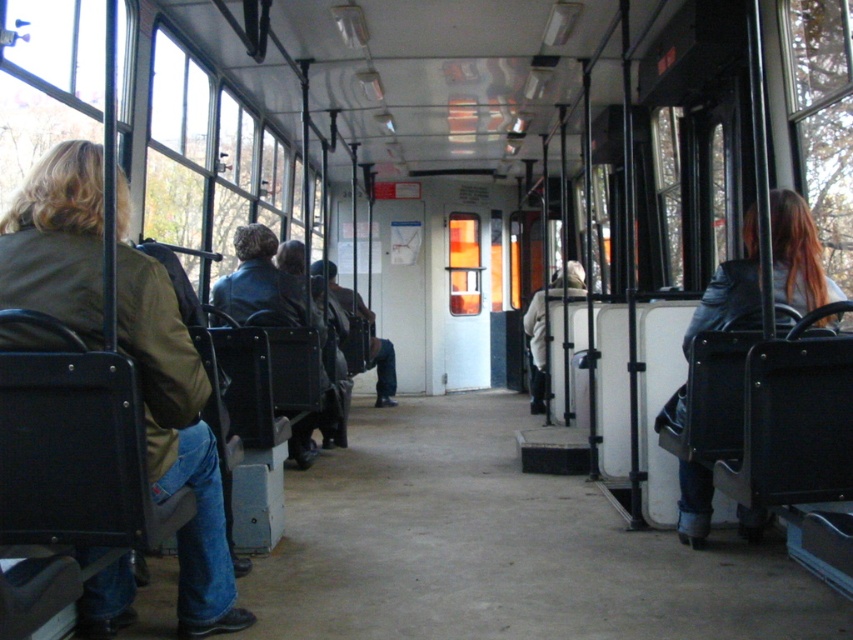
You are standing at the front of the public transportation vehicle and want to reach a destination point located at point (x=538, y=321). There is an obstacle at point (x=722, y=291). Which point is closer to you, the obstacle or the destination?

Point (x=722, y=291) is closer to the viewer than point (x=538, y=321), so the obstacle is closer to you.

You are standing at the front of the tram and want to hand a brochure to the person wearing the leather jacket at right. Based on the jacket position, in which direction should you walk to reach them?

The leather jacket at right is located at point 0.398 on the x axis and 0.936 on the y axis. Since the tram is viewed from the front, the x axis runs from left to right, and the y axis runs from front to back. To reach the jacket at right, you should walk towards the right and towards the back of the tram.